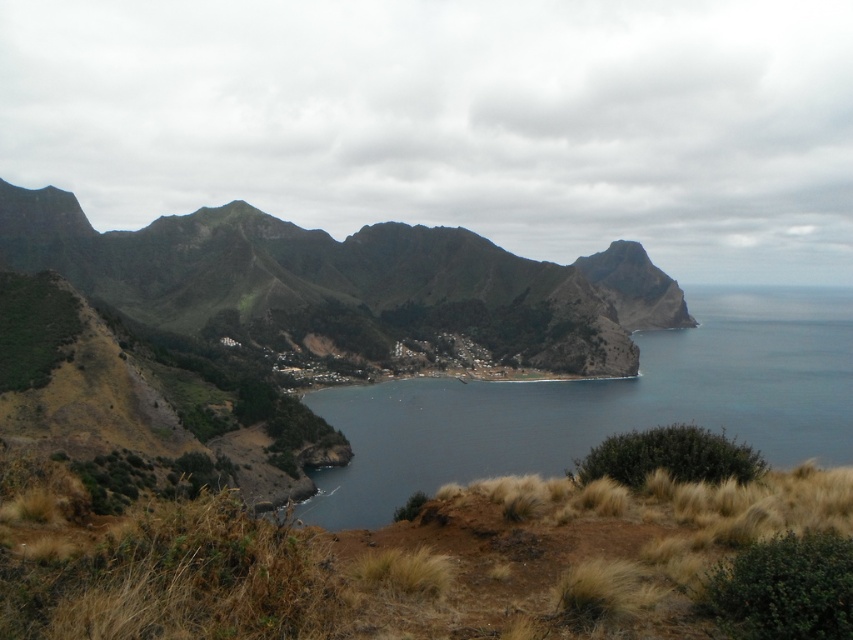
You are standing at the edge of the rugged terrain in the foreground of this coastal landscape. You see the green rough mountain at center and the dark blue water at center. Which object is higher in elevation?

The green rough mountain at center is located above the dark blue water at center, so it has a higher elevation.

You are standing at the camera position and want to reach the point marked as point (236, 250). Is the distance more than 300 meters?

Yes, the distance between the camera and point (236, 250) is 315.22 meters, which is more than 300 meters.